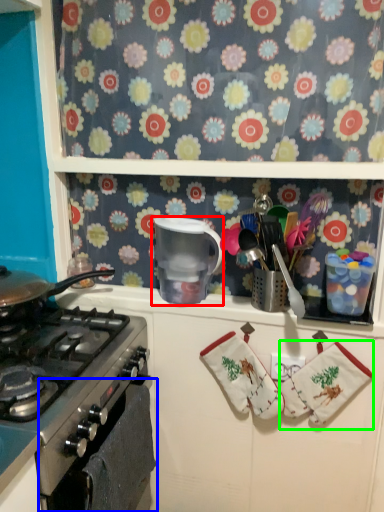
Question: Which object is the closest to the appliance (highlighted by a red box)? Choose among these: oven (highlighted by a blue box) or material (highlighted by a green box).

Choices:
 (A) oven
 (B) material

Answer: (A)